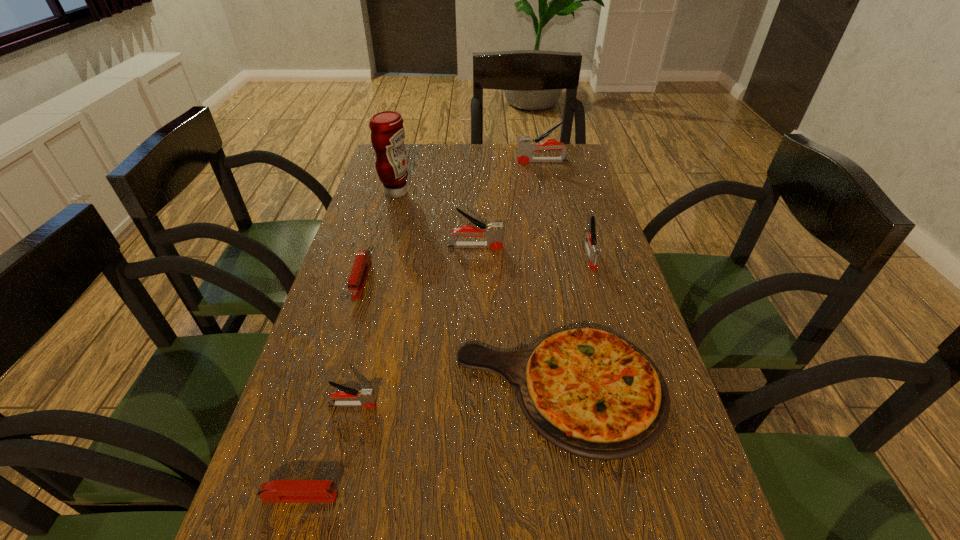
You are a GUI agent. You are given a task and a screenshot of the screen. Output one action in this format:
    pyautogui.click(x=<x>, y=<y>)
    Task: Click on the vacant point at the left edge
    This screenshot has width=960, height=540.
    Given the screenshot: What is the action you would take?
    [297, 377]

Locate an element on the screen. Image resolution: width=960 pixels, height=540 pixels. vacant position at the right edge of the desktop is located at coordinates (580, 247).

The width and height of the screenshot is (960, 540). I want to click on vacant space at the far right corner of the desktop, so click(x=569, y=152).

Where is `free space that is in between the fourth shortest stapler and the second biggest gray stapler`? The height and width of the screenshot is (540, 960). free space that is in between the fourth shortest stapler and the second biggest gray stapler is located at coordinates (532, 251).

The width and height of the screenshot is (960, 540). Find the location of `free point between the nearest stapler and the bigger red stapler`. free point between the nearest stapler and the bigger red stapler is located at coordinates (331, 388).

You are a GUI agent. You are given a task and a screenshot of the screen. Output one action in this format:
    pyautogui.click(x=<x>, y=<y>)
    Task: Click on the unoccupied position between the smaller red stapler and the pizza
    This screenshot has height=540, width=960.
    Given the screenshot: What is the action you would take?
    pyautogui.click(x=430, y=442)

At what (x,y) coordinates should I click in order to perform the action: click on empty space that is in between the farther red stapler and the farthest stapler. Please return your answer as a coordinate pair (x, y). Looking at the image, I should click on (452, 220).

Identify the location of free space between the second tallest stapler and the tallest object. The image size is (960, 540). (436, 219).

The height and width of the screenshot is (540, 960). In order to click on vacant area that lies between the nearest object and the fourth shortest stapler in this screenshot , I will do `click(445, 376)`.

This screenshot has width=960, height=540. What are the coordinates of `the seventh closest object to the fourth shortest stapler` in the screenshot? It's located at (276, 491).